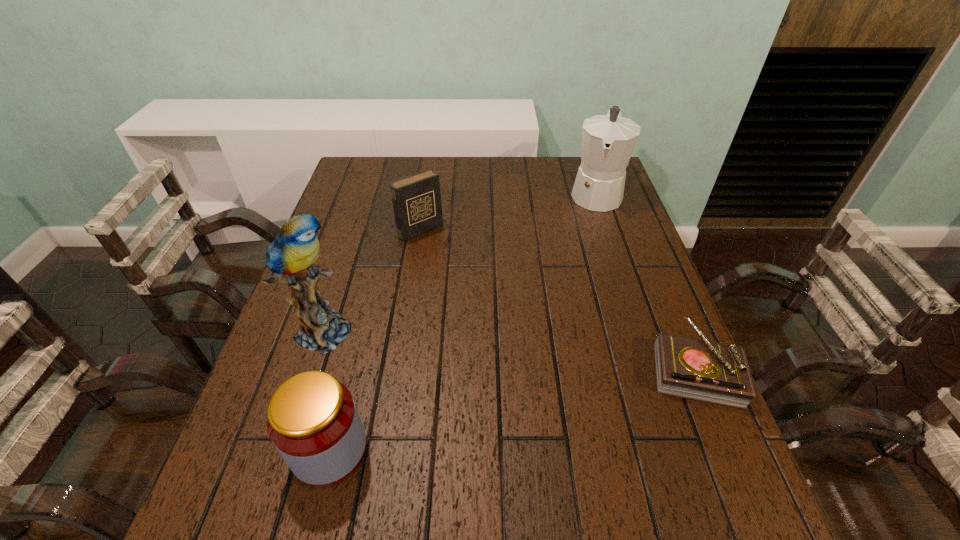
Locate an element on the screen. The height and width of the screenshot is (540, 960). object that is the third closest to the nearest object is located at coordinates point(701,370).

At what (x,y) coordinates should I click in order to perform the action: click on vacant position in the image that satisfies the following two spatial constraints: 1. on the back side of the left diary; 2. on the left side of the nearest object. Please return your answer as a coordinate pair (x, y). Looking at the image, I should click on (385, 230).

Locate an element on the screen. The image size is (960, 540). vacant position in the image that satisfies the following two spatial constraints: 1. on the front side of the shorter diary; 2. on the left side of the parrot is located at coordinates (315, 368).

The width and height of the screenshot is (960, 540). What are the coordinates of `vacant region that satisfies the following two spatial constraints: 1. on the back side of the farther diary; 2. on the left side of the farthest object` in the screenshot? It's located at (426, 193).

Where is `vacant area that satisfies the following two spatial constraints: 1. on the back side of the farthest object; 2. on the left side of the nearest object`? The image size is (960, 540). vacant area that satisfies the following two spatial constraints: 1. on the back side of the farthest object; 2. on the left side of the nearest object is located at coordinates (395, 193).

Where is `free location that satisfies the following two spatial constraints: 1. on the back side of the tallest object; 2. on the right side of the taller diary`? Image resolution: width=960 pixels, height=540 pixels. free location that satisfies the following two spatial constraints: 1. on the back side of the tallest object; 2. on the right side of the taller diary is located at coordinates (359, 230).

Locate an element on the screen. This screenshot has height=540, width=960. free space in the image that satisfies the following two spatial constraints: 1. on the back side of the farthest object; 2. on the left side of the second farthest object is located at coordinates (426, 193).